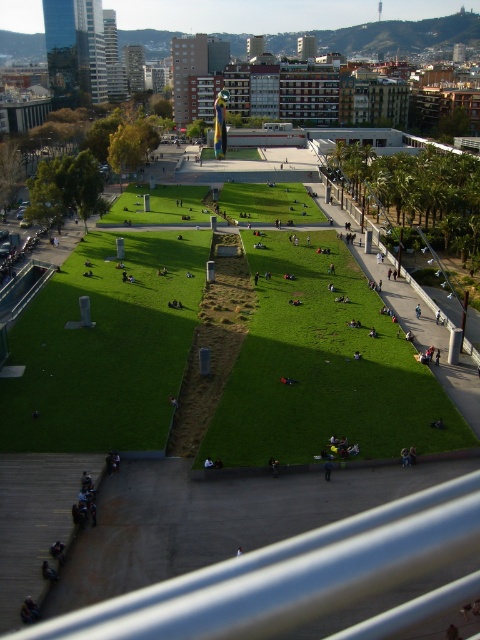
You are a photographer trying to capture a wide shot of the park scene. You notice two people wearing the dark blue jacket at lower center and the smooth black shirt at center. Based on their clothing sizes, which person would appear to have a larger figure in the photo?

The dark blue jacket at lower center has a larger width than the smooth black shirt at center, so the person wearing the dark blue jacket at lower center would appear to have a larger figure in the photo.

You are a photographer standing at the edge of the park and want to take a photo that includes both the dark blue jacket at lower center and the smooth black shirt at center. Based on their positions, which one should you adjust your camera angle to focus on first to ensure both are in frame?

The dark blue jacket at lower center is to the right of the smooth black shirt at center. To include both in the frame, adjust your camera angle to focus on the smooth black shirt at center first, then pan slightly to the right to include the dark blue jacket at lower center.